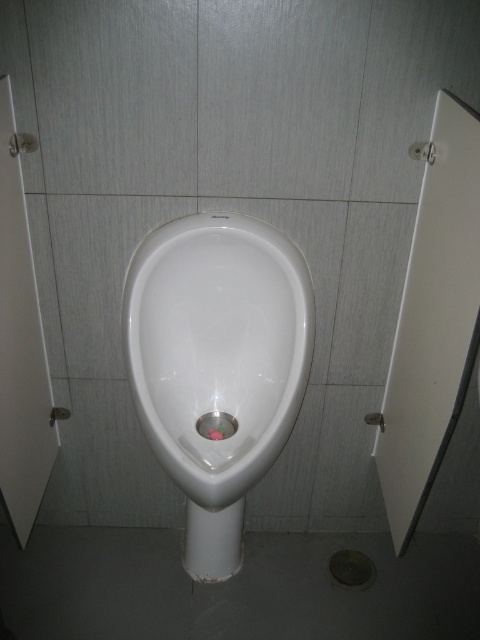
You are a maintenance worker inspecting the restroom facilities. You need to locate the matte metallic drain at lower center. Based on the scene description, where would you find it relative to the white glossy urinal at center?

The matte metallic drain at lower center is on the right side of the white glossy urinal at center.

You are a maintenance worker inspecting the restroom facilities. You need to determine which object, the white glossy urinal at center or the matte metallic drain at lower center, requires immediate attention based on their sizes. Which one is larger?

The white glossy urinal at center is bigger than the matte metallic drain at lower center, so it would require immediate attention based on size.

Consider the image. You are a maintenance worker checking the facilities. You need to clean both the white glossy urinal at center and the metallic silver drain at center. Which one should you clean first if you want to start from the wider object?

The white glossy urinal at center is wider than the metallic silver drain at center, so you should clean the white glossy urinal at center first.